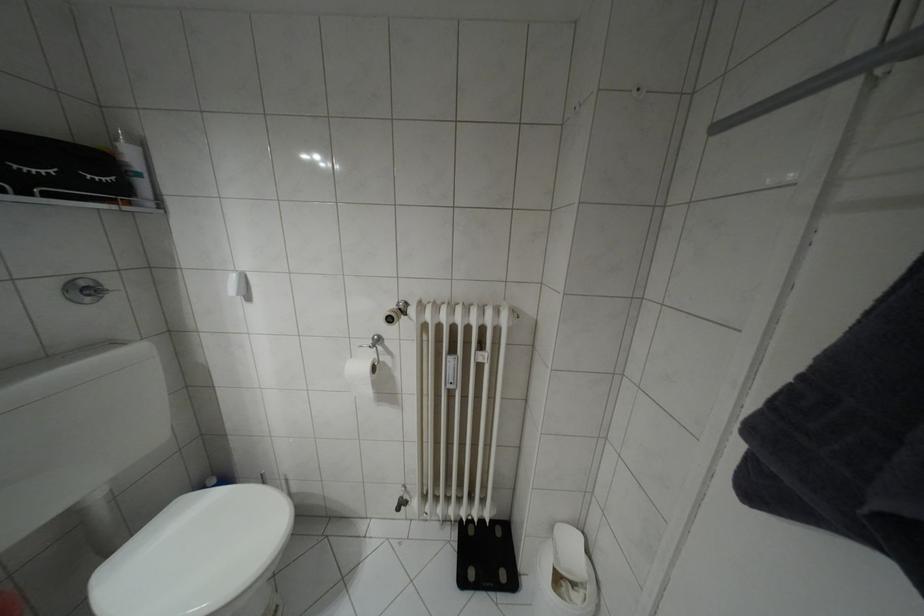
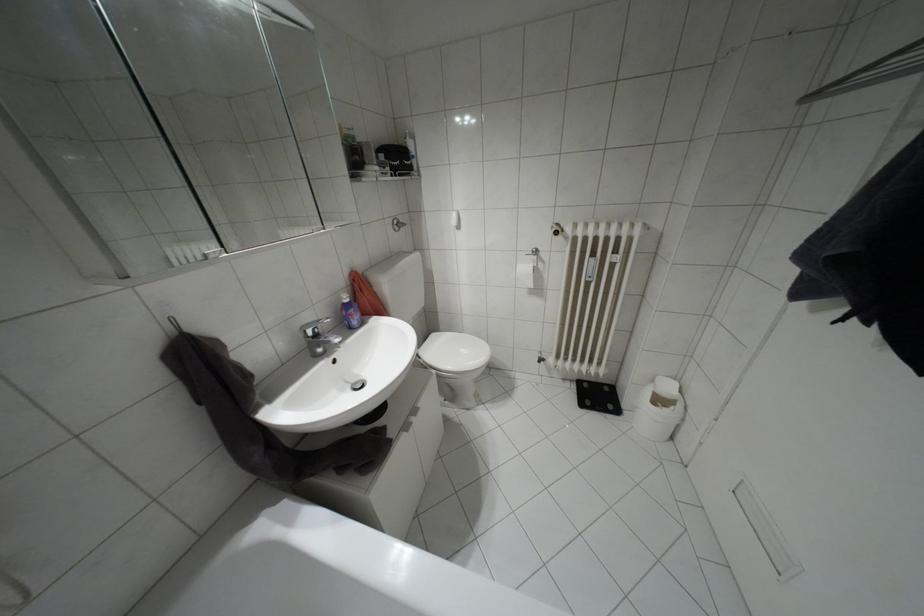
Where in the second image is the point corresponding to [552,528] from the first image?

(652, 379)